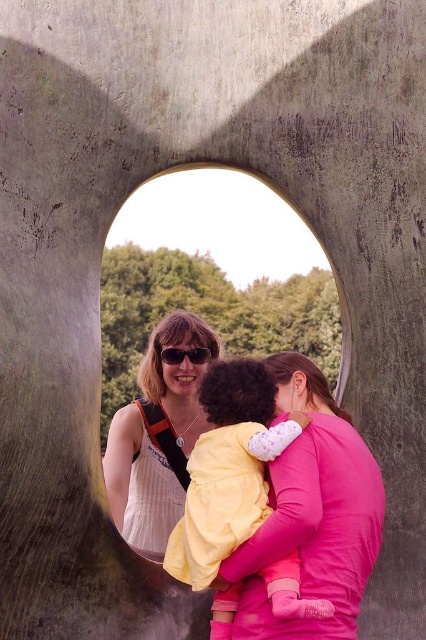
Which is behind, point (101, 291) or point (190, 358)?

The point (101, 291) is behind.

Consider the image. Is concrete wall at center in front of matte black sunglasses at center?

Yes, it is.

Locate an element on the screen. The image size is (426, 640). concrete wall at center is located at coordinates (198, 323).

Who is shorter, yellow fabric baby at center or matte black sunglasses at center?

Standing shorter between the two is matte black sunglasses at center.

Is yellow fabric baby at center closer to the viewer compared to matte black sunglasses at center?

Yes, yellow fabric baby at center is in front of matte black sunglasses at center.

Identify the location of yellow fabric baby at center. (227, 468).

In the scene shown: Can you confirm if white striped dress at center is positioned to the left of matte black sunglasses at center?

Indeed, white striped dress at center is positioned on the left side of matte black sunglasses at center.

Which is behind, point (186, 326) or point (198, 349)?

The point (198, 349) is behind.

Between point (181, 324) and point (193, 353), which one is positioned behind?

The point (193, 353) is behind.

Image resolution: width=426 pixels, height=640 pixels. Identify the location of white striped dress at center. (157, 436).